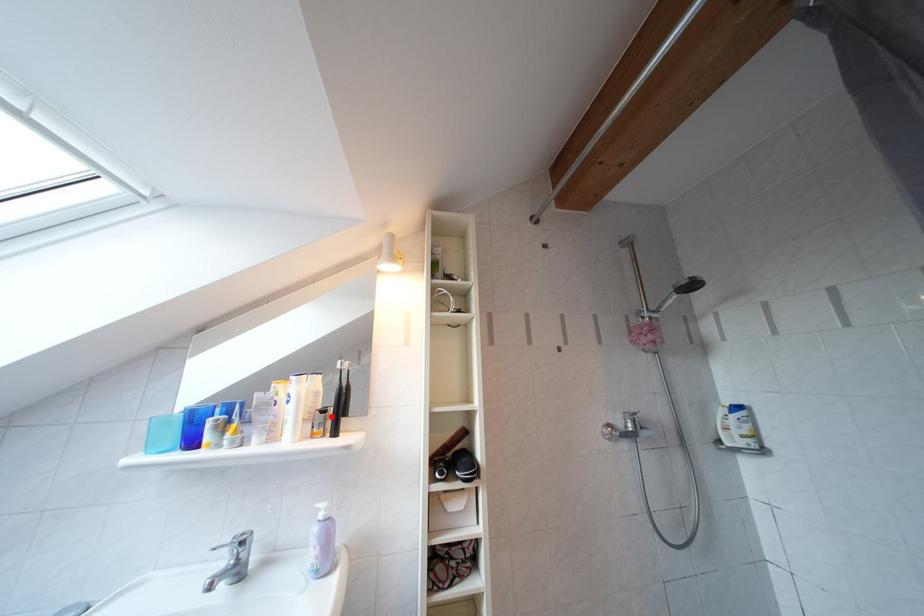
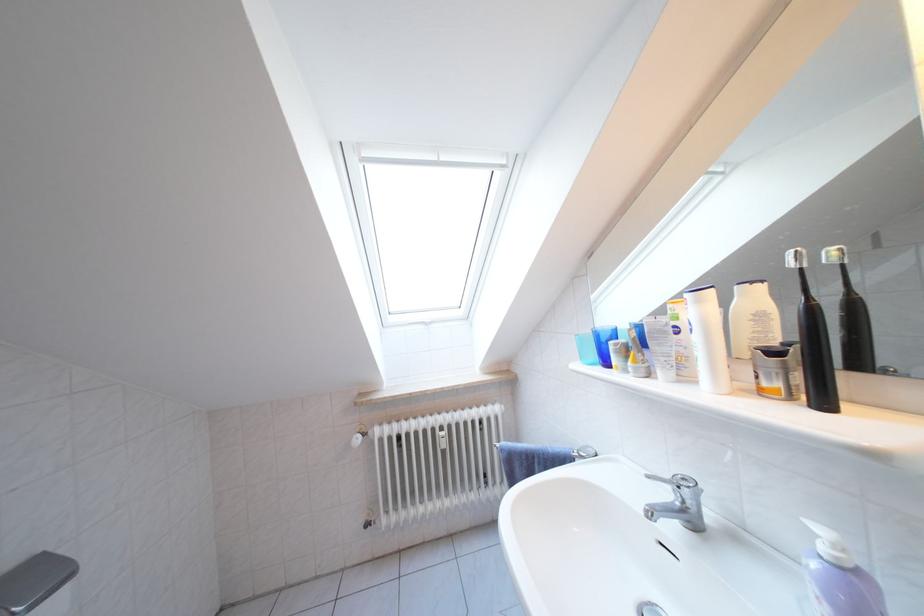
In the second image, find the point that corresponds to the highlighted location in the first image.

(783, 359)